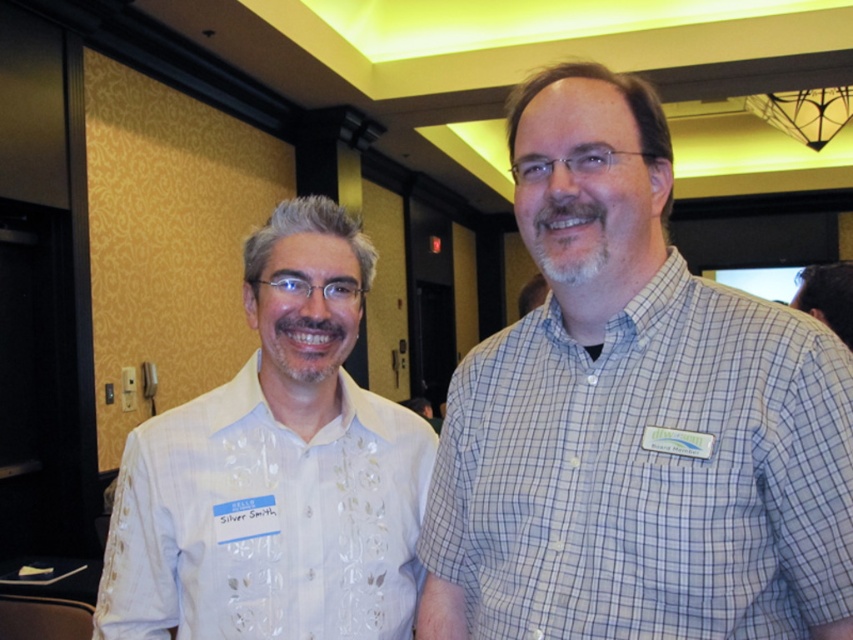
Question: Can you confirm if blue checkered shirt at right is wider than white embroidered shirt at left?

Choices:
 (A) no
 (B) yes

Answer: (A)

Question: Which of the following is the farthest from the observer?

Choices:
 (A) white embroidered shirt at left
 (B) blue checkered shirt at right

Answer: (A)

Question: Where is blue checkered shirt at right located in relation to white embroidered shirt at left in the image?

Choices:
 (A) below
 (B) above

Answer: (B)

Question: Which of the following is the farthest from the observer?

Choices:
 (A) (376, 477)
 (B) (590, 618)

Answer: (A)

Question: Among these points, which one is farthest from the camera?

Choices:
 (A) [196, 486]
 (B) [732, 419]

Answer: (A)

Question: Is blue checkered shirt at right in front of white embroidered shirt at left?

Choices:
 (A) no
 (B) yes

Answer: (B)